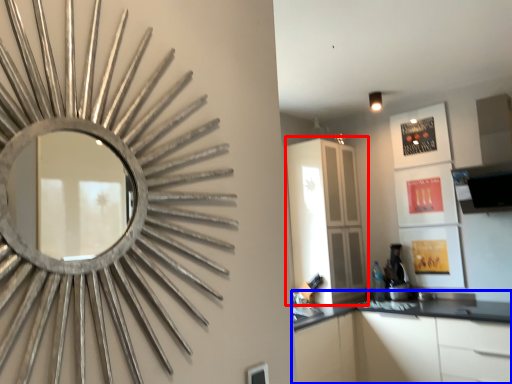
Question: Which of the following is the farthest to the observer, dresser (highlighted by a red box) or cabinetry (highlighted by a blue box)?

Choices:
 (A) dresser
 (B) cabinetry

Answer: (A)